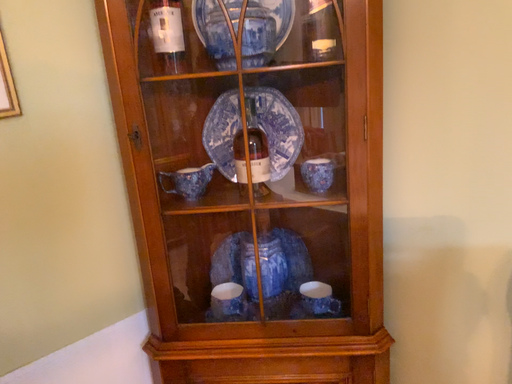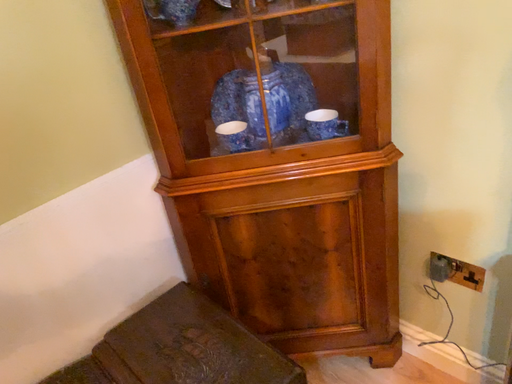
Question: Which way did the camera rotate in the video?

Choices:
 (A) rotated upward
 (B) rotated downward

Answer: (B)